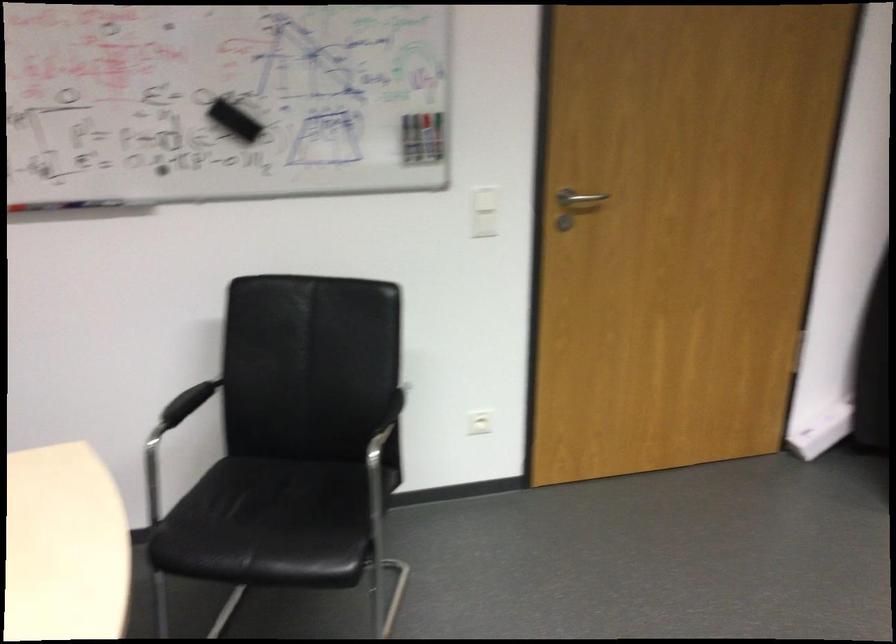
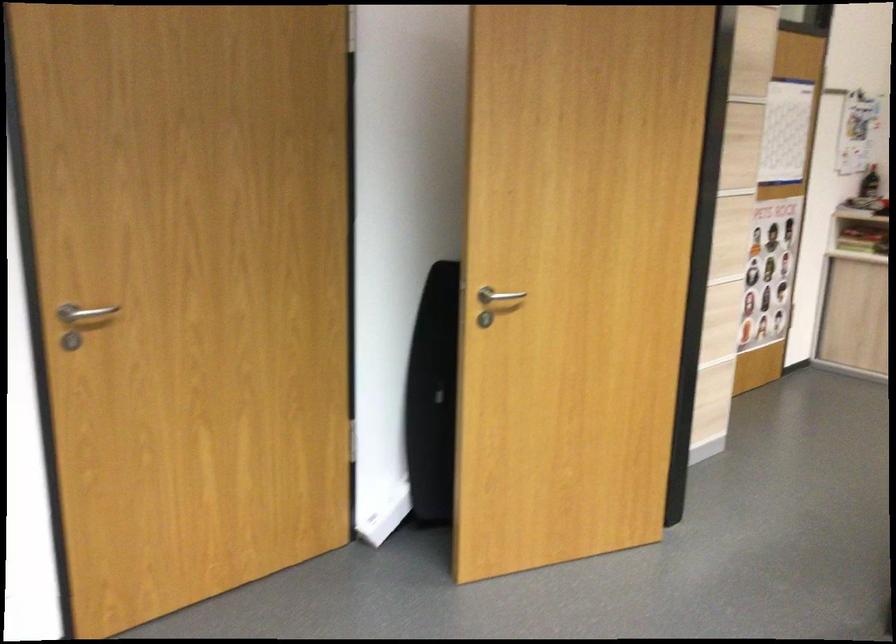
Which direction would the cameraman need to move to produce the second image?

The cameraman moved toward right, forward.